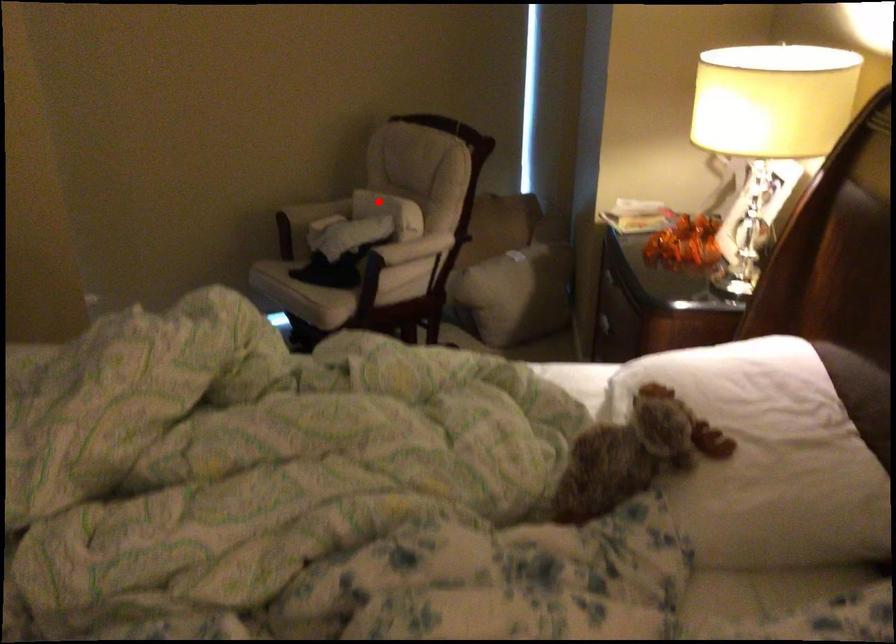
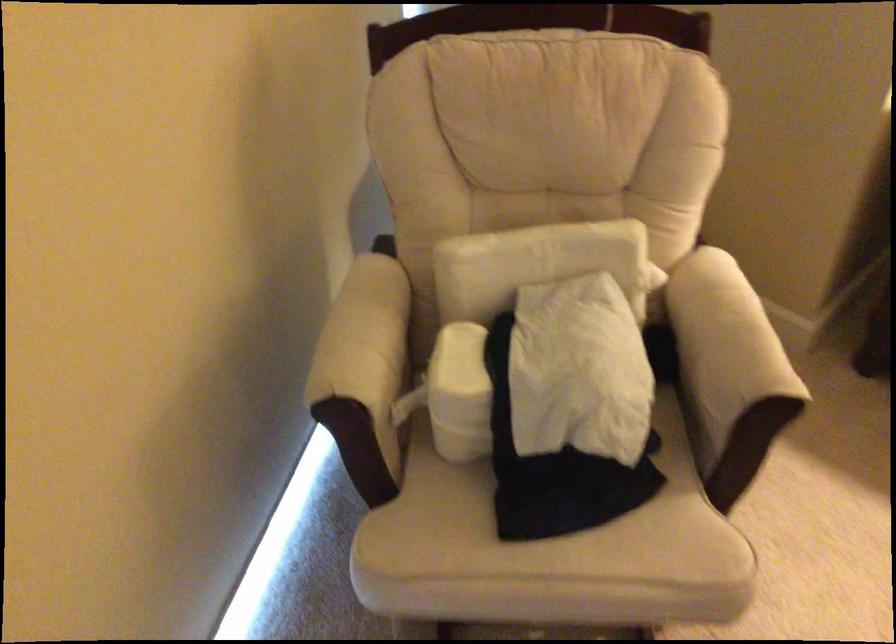
In the second image, find the point that corresponds to the highlighted location in the first image.

(533, 263)